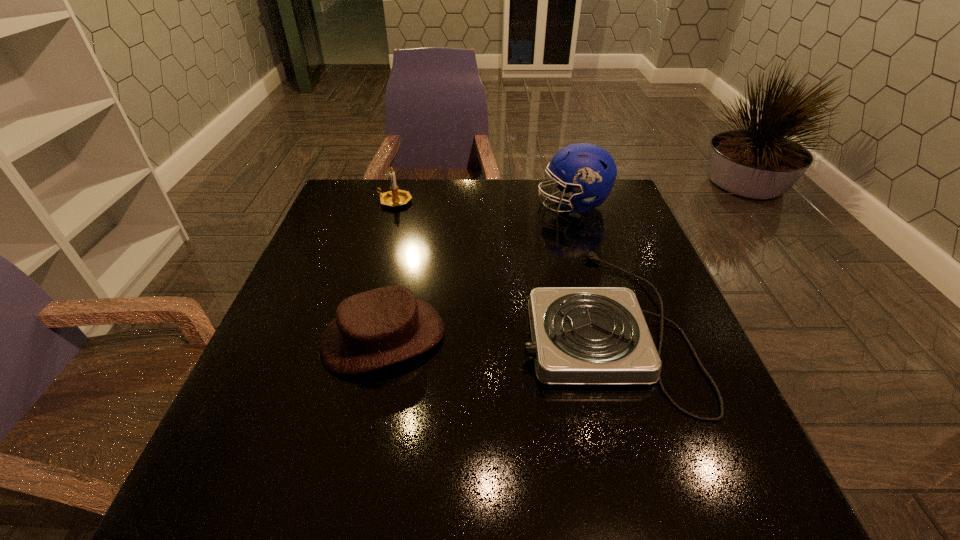
Identify the location of free space at the far edge. The image size is (960, 540). (525, 208).

Locate an element on the screen. The height and width of the screenshot is (540, 960). vacant space at the near edge of the desktop is located at coordinates (516, 494).

Where is `free point at the left edge`? free point at the left edge is located at coordinates (300, 380).

Locate an element on the screen. This screenshot has width=960, height=540. vacant space at the right edge is located at coordinates (655, 322).

Where is `free location at the far right corner of the desktop`? This screenshot has width=960, height=540. free location at the far right corner of the desktop is located at coordinates (637, 217).

Locate an element on the screen. Image resolution: width=960 pixels, height=540 pixels. vacant space in between the shortest object and the hat is located at coordinates (492, 330).

I want to click on vacant space that is in between the candle holder and the football helmet, so click(484, 203).

I want to click on free spot between the tallest object and the hotplate, so click(588, 264).

Identify the location of vacant space that is in between the third tallest object and the football helmet. (478, 271).

The width and height of the screenshot is (960, 540). I want to click on free space between the hotplate and the second shortest object, so click(492, 330).